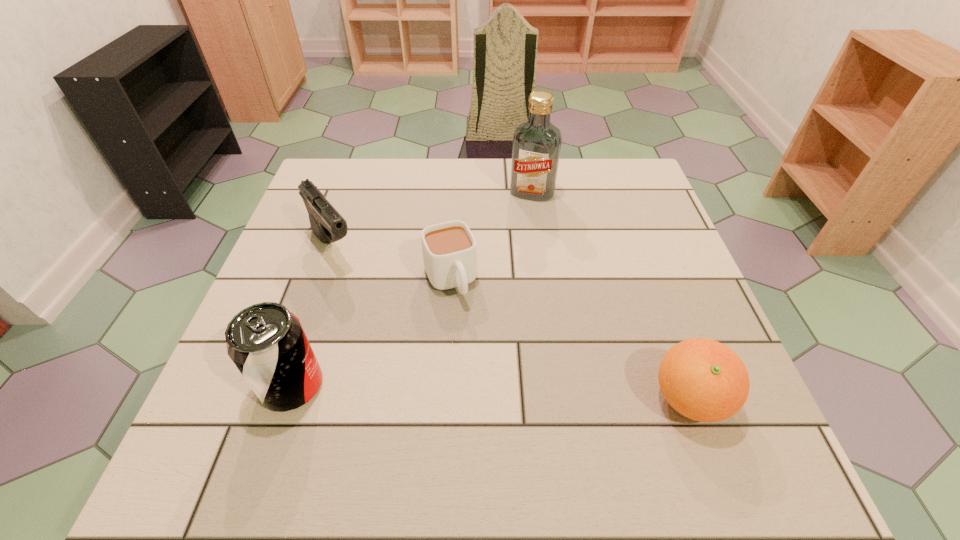
This screenshot has height=540, width=960. Find the location of `vacant space that is in between the soda can and the vodka`. vacant space that is in between the soda can and the vodka is located at coordinates (412, 289).

Image resolution: width=960 pixels, height=540 pixels. In order to click on free space between the tallest object and the soda can in this screenshot , I will do `click(412, 289)`.

The height and width of the screenshot is (540, 960). Find the location of `object that is the second closest to the soda can`. object that is the second closest to the soda can is located at coordinates (327, 224).

Locate which object is the fourth closest to the cup. Please provide its 2D coordinates. Your answer should be formatted as a tuple, i.e. [(x, y)], where the tuple contains the x and y coordinates of a point satisfying the conditions above.

[(704, 380)]

Find the location of a particular element. vacant area that satisfies the following two spatial constraints: 1. on the front side of the soda can; 2. on the right side of the orange is located at coordinates [x=288, y=399].

The height and width of the screenshot is (540, 960). Find the location of `vacant space that satisfies the following two spatial constraints: 1. on the front side of the fourth tallest object; 2. on the right side of the pistol`. vacant space that satisfies the following two spatial constraints: 1. on the front side of the fourth tallest object; 2. on the right side of the pistol is located at coordinates (283, 399).